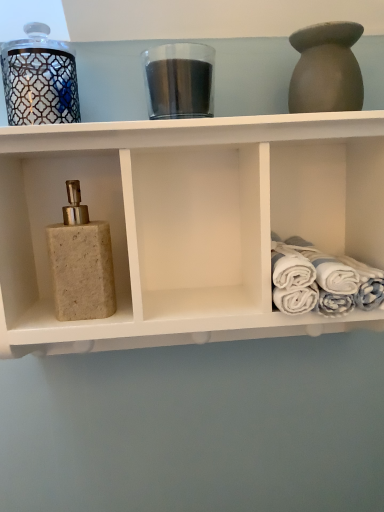
Question: From the image's perspective, is beige stone soap dispenser at left located above beige stone soap dispenser at left?

Choices:
 (A) no
 (B) yes

Answer: (A)

Question: Would you say beige stone soap dispenser at left contains beige stone soap dispenser at left?

Choices:
 (A) no
 (B) yes

Answer: (B)

Question: Can you confirm if beige stone soap dispenser at left is shorter than beige stone soap dispenser at left?

Choices:
 (A) no
 (B) yes

Answer: (A)

Question: Is beige stone soap dispenser at left aimed at beige stone soap dispenser at left?

Choices:
 (A) yes
 (B) no

Answer: (A)

Question: Can you confirm if beige stone soap dispenser at left is wider than beige stone soap dispenser at left?

Choices:
 (A) yes
 (B) no

Answer: (A)

Question: From the image's perspective, is matte clay vase at upper right located above or below beige stone soap dispenser at left?

Choices:
 (A) below
 (B) above

Answer: (B)

Question: In the image, is matte clay vase at upper right on the left side or the right side of beige stone soap dispenser at left?

Choices:
 (A) left
 (B) right

Answer: (B)

Question: From a real-world perspective, relative to beige stone soap dispenser at left, is matte clay vase at upper right vertically above or below?

Choices:
 (A) below
 (B) above

Answer: (B)

Question: Is matte clay vase at upper right inside or outside of beige stone soap dispenser at left?

Choices:
 (A) inside
 (B) outside

Answer: (B)

Question: Looking at the image, does white cotton towels at right seem bigger or smaller compared to matte clay vase at upper right?

Choices:
 (A) big
 (B) small

Answer: (A)

Question: Considering their positions, is white cotton towels at right located in front of or behind matte clay vase at upper right?

Choices:
 (A) behind
 (B) front

Answer: (A)

Question: Is white cotton towels at right situated inside matte clay vase at upper right or outside?

Choices:
 (A) outside
 (B) inside

Answer: (A)

Question: Considering the positions of white cotton towels at right and matte clay vase at upper right in the image, is white cotton towels at right taller or shorter than matte clay vase at upper right?

Choices:
 (A) tall
 (B) short

Answer: (B)

Question: From the image's perspective, relative to beige stone soap dispenser at left, is transparent glass jar at center, the second glass jar when ordered from left to right, above or below?

Choices:
 (A) above
 (B) below

Answer: (A)

Question: Looking at the image, does transparent glass jar at center, which is the 1th glass jar from right to left, seem bigger or smaller compared to beige stone soap dispenser at left?

Choices:
 (A) small
 (B) big

Answer: (A)